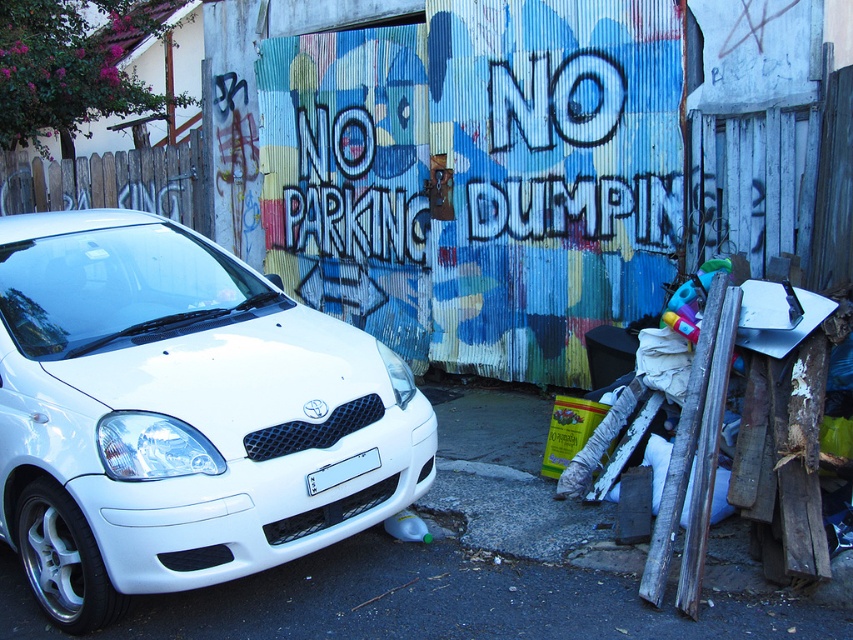
Question: Which of the following is the farthest from the observer?

Choices:
 (A) (335, 481)
 (B) (395, 403)

Answer: (B)

Question: Where is white glossy car at left located in relation to white plastic license plate at center in the image?

Choices:
 (A) above
 (B) below

Answer: (A)

Question: Which of the following is the farthest from the observer?

Choices:
 (A) (190, 502)
 (B) (354, 474)

Answer: (B)

Question: Observing the image, what is the correct spatial positioning of white glossy car at left in reference to white plastic license plate at center?

Choices:
 (A) right
 (B) left

Answer: (B)

Question: Can you confirm if white glossy car at left is positioned to the right of white plastic license plate at center?

Choices:
 (A) no
 (B) yes

Answer: (A)